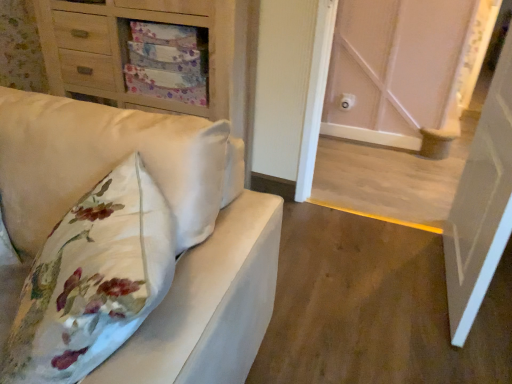
Question: From a real-world perspective, is white glossy door at right, which ranks as the 2th door in back-to-front order, positioned under white wood door at center, the second door in the front-to-back sequence, based on gravity?

Choices:
 (A) no
 (B) yes

Answer: (A)

Question: Is white glossy door at right, acting as the 1th door starting from the front, closer to the viewer compared to white wood door at center, arranged as the 1th door when viewed from the back?

Choices:
 (A) yes
 (B) no

Answer: (A)

Question: Does white glossy door at right, acting as the 1th door starting from the front, appear on the right side of white wood door at center, arranged as the 1th door when viewed from the back?

Choices:
 (A) yes
 (B) no

Answer: (A)

Question: Is there a large distance between white glossy door at right, acting as the 1th door starting from the front, and white wood door at center, the second door in the front-to-back sequence?

Choices:
 (A) yes
 (B) no

Answer: (A)

Question: Considering the relative sizes of white glossy door at right, which ranks as the 2th door in back-to-front order, and white wood door at center, arranged as the 1th door when viewed from the back, in the image provided, is white glossy door at right, which ranks as the 2th door in back-to-front order, wider than white wood door at center, arranged as the 1th door when viewed from the back,?

Choices:
 (A) no
 (B) yes

Answer: (B)

Question: Based on their positions, is white wood door at center, arranged as the 1th door when viewed from the back, located to the left or right of matte wood chest of drawers at upper left?

Choices:
 (A) right
 (B) left

Answer: (A)

Question: Based on their sizes in the image, would you say white wood door at center, the second door in the front-to-back sequence, is bigger or smaller than matte wood chest of drawers at upper left?

Choices:
 (A) big
 (B) small

Answer: (B)

Question: Relative to matte wood chest of drawers at upper left, is white wood door at center, the second door in the front-to-back sequence, in front or behind?

Choices:
 (A) front
 (B) behind

Answer: (A)

Question: Considering the positions of white wood door at center, the second door in the front-to-back sequence, and matte wood chest of drawers at upper left in the image, is white wood door at center, the second door in the front-to-back sequence, wider or thinner than matte wood chest of drawers at upper left?

Choices:
 (A) thin
 (B) wide

Answer: (A)

Question: Considering the positions of matte wood chest of drawers at upper left and white wood door at center, arranged as the 1th door when viewed from the back, in the image, is matte wood chest of drawers at upper left taller or shorter than white wood door at center, arranged as the 1th door when viewed from the back,?

Choices:
 (A) tall
 (B) short

Answer: (B)

Question: Is point (175, 23) positioned closer to the camera than point (370, 122)?

Choices:
 (A) closer
 (B) farther

Answer: (A)

Question: From the image's perspective, is matte wood chest of drawers at upper left above or below white wood door at center, arranged as the 1th door when viewed from the back?

Choices:
 (A) below
 (B) above

Answer: (B)

Question: Is matte wood chest of drawers at upper left wider or thinner than white wood door at center, arranged as the 1th door when viewed from the back?

Choices:
 (A) thin
 (B) wide

Answer: (B)

Question: Relative to white glossy door at right, which ranks as the 2th door in back-to-front order, is white wood door at center, the second door in the front-to-back sequence, in front or behind?

Choices:
 (A) behind
 (B) front

Answer: (A)

Question: Is white wood door at center, the second door in the front-to-back sequence, bigger or smaller than white glossy door at right, which ranks as the 2th door in back-to-front order?

Choices:
 (A) small
 (B) big

Answer: (A)